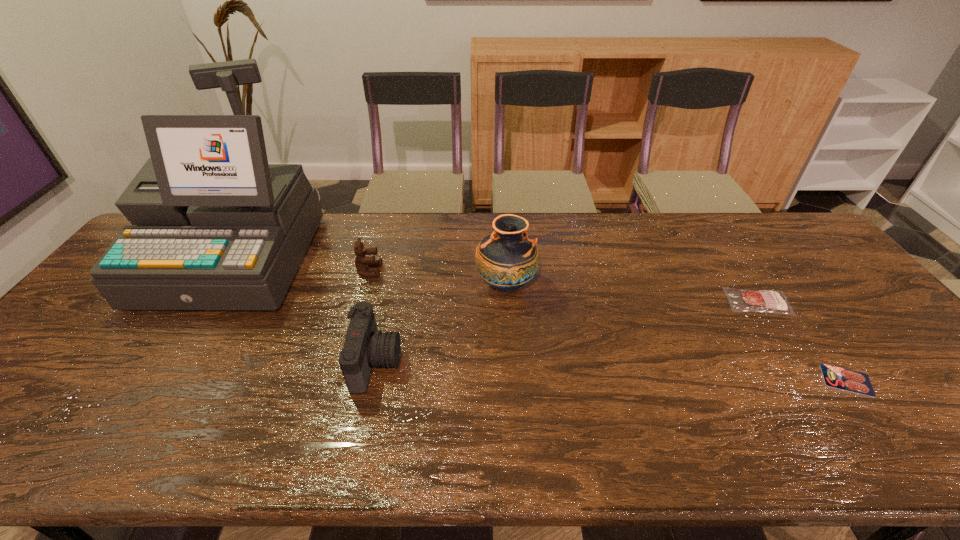
This screenshot has width=960, height=540. I want to click on vacant space located at the lens of the camera, so click(x=551, y=362).

You are a GUI agent. You are given a task and a screenshot of the screen. Output one action in this format:
    pyautogui.click(x=<x>, y=<y>)
    Task: Click on the vacant area situated 0.180m on the face of the teddy bear
    The height and width of the screenshot is (540, 960).
    Given the screenshot: What is the action you would take?
    pyautogui.click(x=441, y=271)

Find the location of `vacant space situated 0.100m on the right of the steak`. vacant space situated 0.100m on the right of the steak is located at coordinates (826, 302).

This screenshot has width=960, height=540. Find the location of `vacant space located on the left of the shortest object`. vacant space located on the left of the shortest object is located at coordinates (674, 380).

In order to click on object located in the far edge section of the desktop in this screenshot , I will do click(x=218, y=228).

At what (x,y) coordinates should I click in order to perform the action: click on object positioned at the left edge. Please return your answer as a coordinate pair (x, y). Looking at the image, I should click on (218, 228).

The image size is (960, 540). Identify the location of object that is at the right edge. (849, 380).

At what (x,y) coordinates should I click in order to perform the action: click on object located at the far left corner. Please return your answer as a coordinate pair (x, y). This screenshot has height=540, width=960. Looking at the image, I should click on (218, 228).

The image size is (960, 540). Identify the location of vacant space at the far edge. (562, 233).

Locate an element on the screen. Image resolution: width=960 pixels, height=540 pixels. vacant point at the near edge is located at coordinates (283, 457).